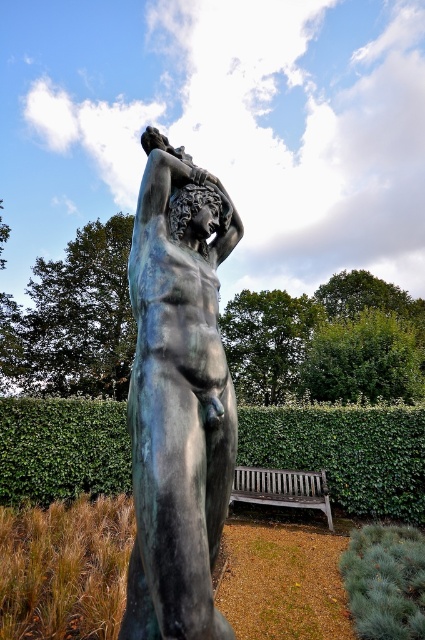
You are a gardener planning to water the bronze statue at center and the green leafy hedge at center. Since both are in the garden, which one should you water first if you start from the left side of the garden?

You should water the green leafy hedge at center first because the bronze statue at center is to the right of it, so the hedge is closer to the left side where you started.

Consider the image. You are a painter who wants to capture the scene in front of you. You need to decide which object to focus on first based on their sizes. Which object is taller between the bronze statue at center and the wooden bench at lower center?

The bronze statue at center is taller than the wooden bench at lower center according to the description, so you should focus on the bronze statue at center first because it is taller.